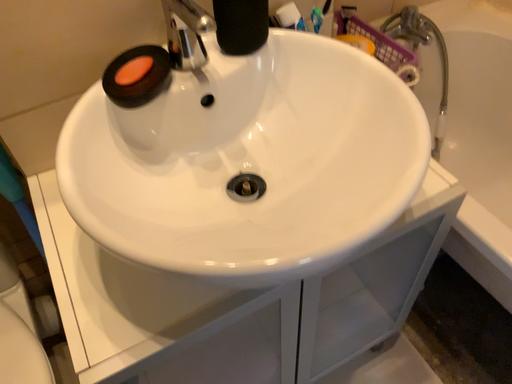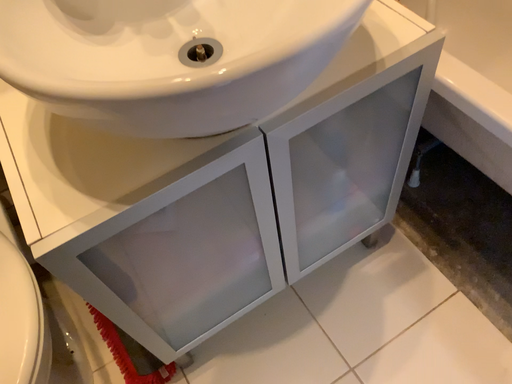
Question: Which way did the camera rotate in the video?

Choices:
 (A) rotated downward
 (B) rotated upward

Answer: (A)